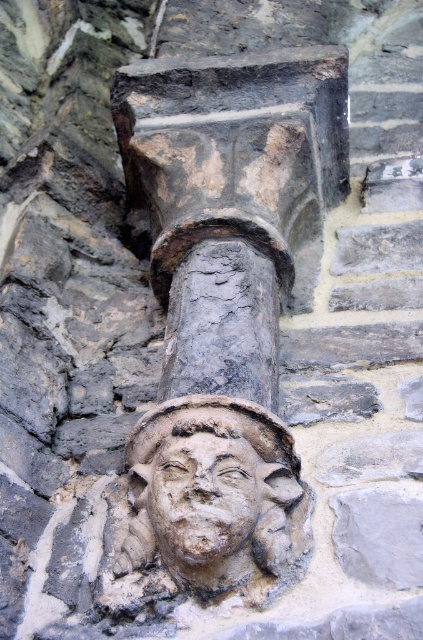
You are an architect examining a historical building detail. You notice the dark gray stone pillar at center and the stone carved face at center. Which object would require more material to construct, considering their sizes?

The dark gray stone pillar at center is bigger than the stone carved face at center, so it would require more material to construct.

You are an architect examining the stone detail. You notice the dark gray stone pillar at center and the stone carved face at center. Based on their positions, which object is located to the right of the other?

The dark gray stone pillar at center is to the right of the stone carved face at center.

You are an architect examining the stone carving. You notice two points marked on the image at coordinates point [164,244] and point [242,492]. Which point is closer to your current position as you observe the carving?

Point [164,244] is further to the camera than point [242,492], so the point closer to your position is point [242,492].